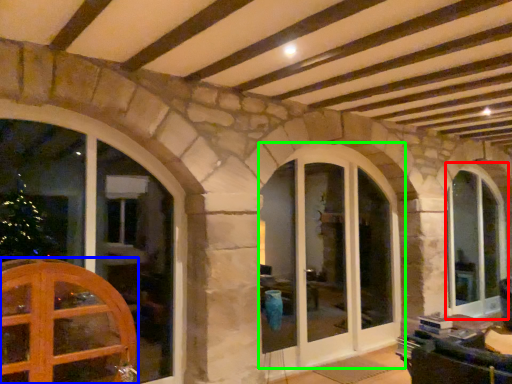
Question: Based on their relative distances, which object is nearer to window (highlighted by a red box)? Choose from door (highlighted by a blue box) and window (highlighted by a green box).

Choices:
 (A) door
 (B) window

Answer: (B)